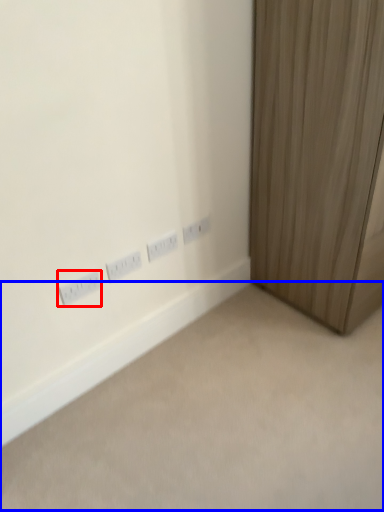
Question: Which point is closer to the camera, power plugs and sockets (highlighted by a red box) or plain (highlighted by a blue box)?

Choices:
 (A) power plugs and sockets
 (B) plain

Answer: (B)